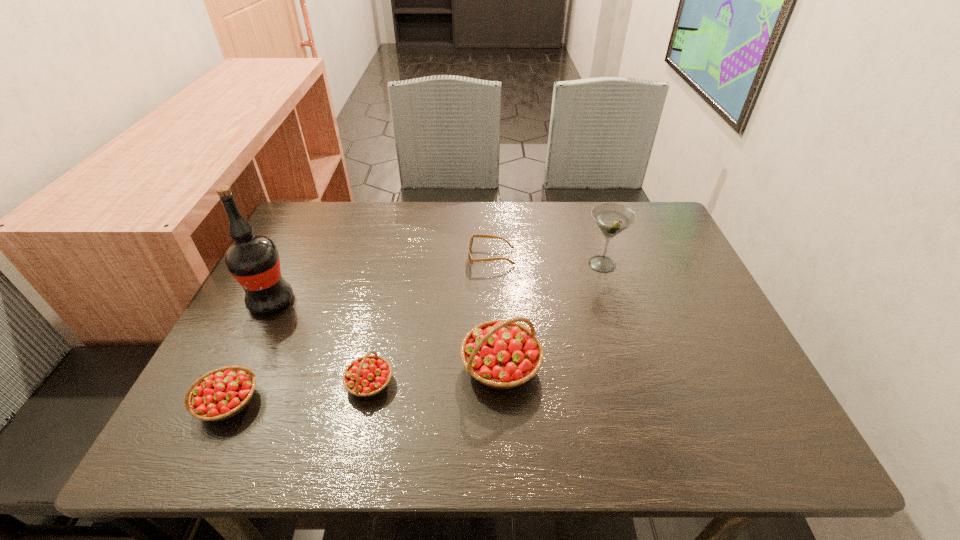
Identify which strawberry is the closest to the fourth tallest object. Please provide its 2D coordinates. Your answer should be formatted as a tuple, i.e. [(x, y)], where the tuple contains the x and y coordinates of a point satisfying the conditions above.

[(367, 376)]

The width and height of the screenshot is (960, 540). I want to click on vacant space that satisfies the following two spatial constraints: 1. on the back side of the fifth shortest object; 2. on the left side of the fourth nearest object, so click(x=289, y=265).

The width and height of the screenshot is (960, 540). I want to click on free space that satisfies the following two spatial constraints: 1. on the front-facing side of the shortest object; 2. on the left side of the rightmost strawberry, so click(495, 366).

The image size is (960, 540). Find the location of `free spot that satisfies the following two spatial constraints: 1. on the back side of the tallest strawberry; 2. on the front-facing side of the sunglasses`. free spot that satisfies the following two spatial constraints: 1. on the back side of the tallest strawberry; 2. on the front-facing side of the sunglasses is located at coordinates click(x=496, y=258).

This screenshot has width=960, height=540. I want to click on free space that satisfies the following two spatial constraints: 1. on the back side of the fourth tallest object; 2. on the left side of the fourth object from right to left, so click(x=237, y=383).

Locate an element on the screen. vacant area that satisfies the following two spatial constraints: 1. on the back side of the tallest strawberry; 2. on the right side of the shortest strawberry is located at coordinates (373, 366).

I want to click on blank space that satisfies the following two spatial constraints: 1. on the front-facing side of the sunglasses; 2. on the front side of the fifth tallest object, so click(x=495, y=383).